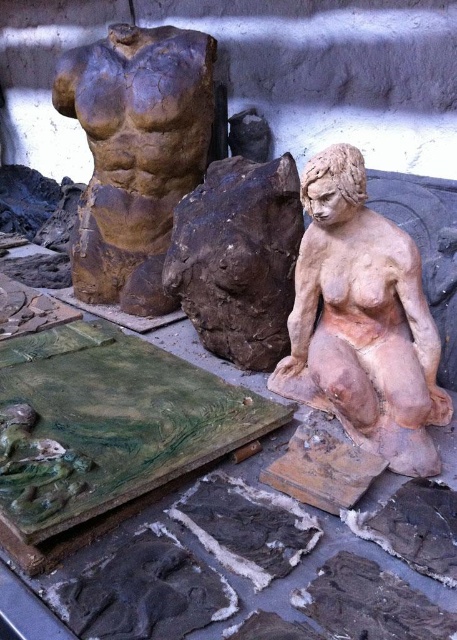
Who is shorter, matte clay torso at upper center or brown clay torso at upper left?

matte clay torso at upper center

Is the position of matte clay torso at upper center less distant than that of brown clay torso at upper left?

Yes, matte clay torso at upper center is closer to the viewer.

Identify the location of matte clay torso at upper center. (362, 321).